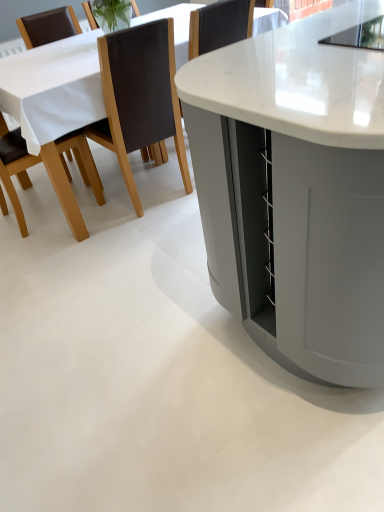
Question: Would you say brown leather chair at left, the 1th chair viewed from the left, is inside or outside brown leather chair at upper left, the 2th chair positioned from the left?

Choices:
 (A) inside
 (B) outside

Answer: (B)

Question: From the image's perspective, relative to brown leather chair at upper left, which is the 1th chair from right to left, is brown leather chair at left, the 1th chair viewed from the left, above or below?

Choices:
 (A) above
 (B) below

Answer: (B)

Question: Which is farther from the white marble table at center, positioned as the first table in front-to-back order?

Choices:
 (A) white marble table at center, the 1th table viewed from the back
 (B) brown leather chair at upper left, which is the 1th chair from right to left
 (C) brown leather chair at left, the 1th chair viewed from the left

Answer: (C)

Question: Which object is positioned closest to the brown leather chair at left, the 2th chair in the right-to-left sequence?

Choices:
 (A) white marble table at center, the 1th table viewed from the back
 (B) white marble table at center, placed as the second table when sorted from back to front
 (C) brown leather chair at upper left, the 2th chair positioned from the left

Answer: (A)